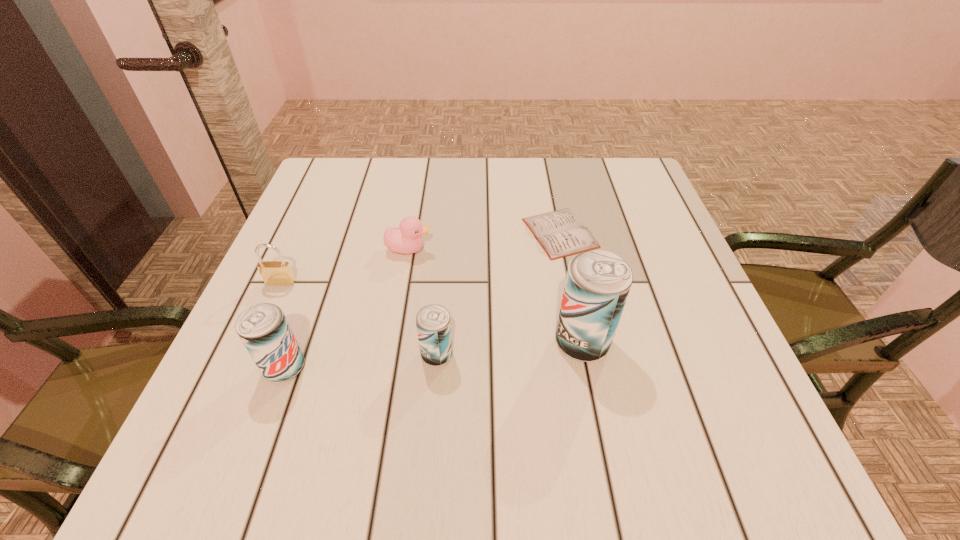
You are a GUI agent. You are given a task and a screenshot of the screen. Output one action in this format:
    pyautogui.click(x=<x>, y=<y>)
    Task: Click on the vacant space that satisfies the following two spatial constraints: 1. on the front-facing side of the fourth object from left to right; 2. on the left side of the padlock
    The width and height of the screenshot is (960, 540).
    Given the screenshot: What is the action you would take?
    pyautogui.click(x=249, y=355)

At what (x,y) coordinates should I click in order to perform the action: click on free spot that satisfies the following two spatial constraints: 1. on the front-facing side of the duckling; 2. on the front-facing side of the leftmost object. Please return your answer as a coordinate pair (x, y). The image size is (960, 540). Looking at the image, I should click on (403, 282).